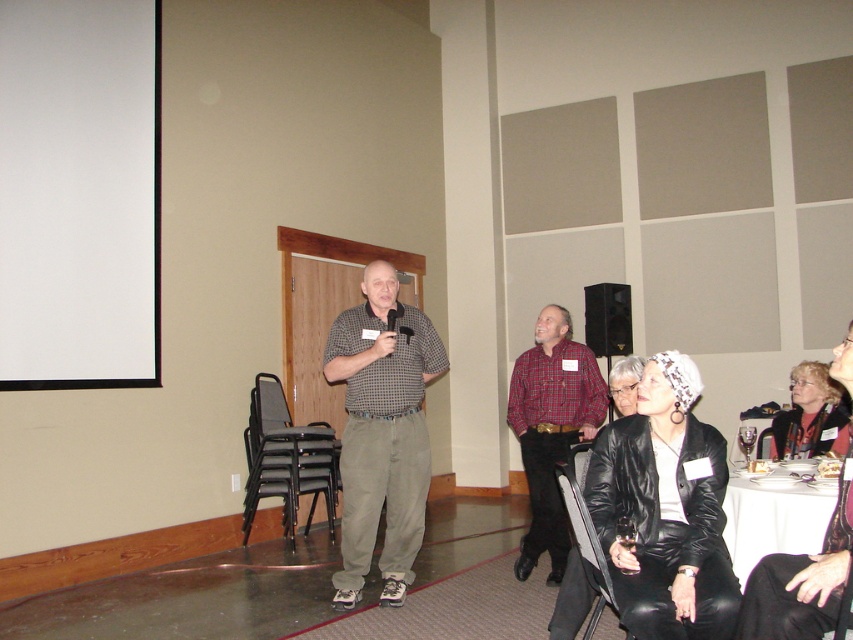
Question: Can you confirm if black leather jacket at lower right is bigger than checkered fabric shirt at center?

Choices:
 (A) yes
 (B) no

Answer: (B)

Question: Does checkered fabric shirt at center have a greater width compared to white cloth-covered table at lower right?

Choices:
 (A) yes
 (B) no

Answer: (A)

Question: Based on their relative distances, which object is nearer to the white matte projection screen at upper left?

Choices:
 (A) checkered fabric shirt at center
 (B) matte black speaker at center
 (C) plaid shirt at center

Answer: (A)

Question: Which object is closer to the camera taking this photo?

Choices:
 (A) checkered fabric shirt at center
 (B) white cloth-covered table at lower right
 (C) white matte projection screen at upper left

Answer: (B)

Question: Where is black leather jacket at lower right located in relation to white cloth-covered table at lower right in the image?

Choices:
 (A) left
 (B) right

Answer: (A)

Question: Among these points, which one is nearest to the camera?

Choices:
 (A) (608, 538)
 (B) (35, 355)
 (C) (762, 538)
 (D) (585, 403)

Answer: (A)